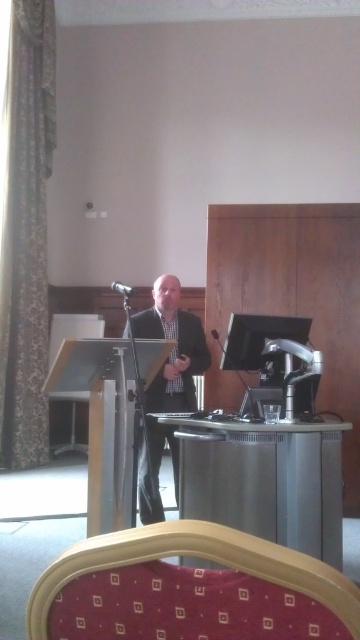
Question: From the image, what is the correct spatial relationship of satin silver podium at center in relation to dark suit at center?

Choices:
 (A) right
 (B) left

Answer: (A)

Question: Which of the following is the closest to the observer?

Choices:
 (A) (113, 289)
 (B) (213, 328)

Answer: (B)

Question: Considering the relative positions of dark suit at center and black metallic microphone at center in the image provided, where is dark suit at center located with respect to black metallic microphone at center?

Choices:
 (A) left
 (B) right

Answer: (A)

Question: Which object appears closest to the camera in this image?

Choices:
 (A) satin silver podium at center
 (B) dark suit at center

Answer: (A)

Question: Estimate the real-world distances between objects in this image. Which object is closer to the black matte microphone at center?

Choices:
 (A) black metallic microphone at center
 (B) satin silver podium at center

Answer: (A)

Question: Does dark suit at center appear on the right side of black metallic microphone at center?

Choices:
 (A) no
 (B) yes

Answer: (A)